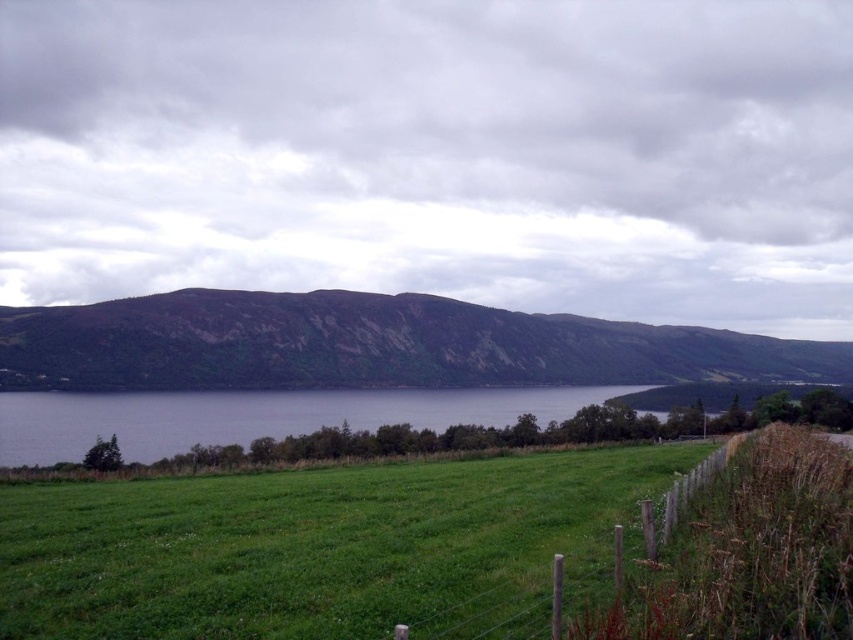
Question: Which point is closer to the camera?

Choices:
 (A) brown rocky mountain at center
 (B) wooden post fence at lower right
 (C) green grassy field at lower center
 (D) green grassy field at center

Answer: (B)

Question: Which point is farther from the camera taking this photo?

Choices:
 (A) (448, 620)
 (B) (616, 548)

Answer: (B)

Question: Is green grassy field at center closer to camera compared to brown rocky mountain at center?

Choices:
 (A) no
 (B) yes

Answer: (B)

Question: Is green grassy field at lower center to the left of wooden post fence at lower right from the viewer's perspective?

Choices:
 (A) yes
 (B) no

Answer: (A)

Question: From the image, what is the correct spatial relationship of brown rocky mountain at center in relation to wooden post fence at lower right?

Choices:
 (A) above
 (B) below

Answer: (A)

Question: Which point appears closest to the camera in this image?

Choices:
 (A) (704, 372)
 (B) (363, 410)
 (C) (360, 604)
 (D) (521, 596)

Answer: (C)